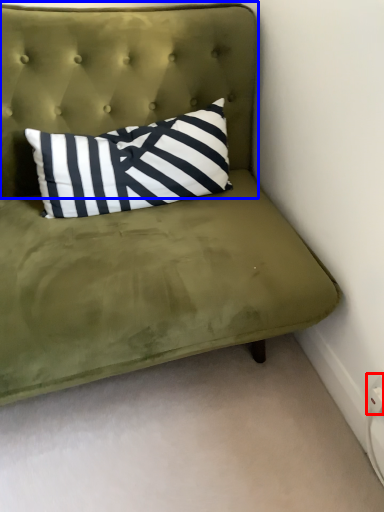
Question: Which object appears closest to the camera in this image, electric outlet (highlighted by a red box) or headboard (highlighted by a blue box)?

Choices:
 (A) electric outlet
 (B) headboard

Answer: (B)